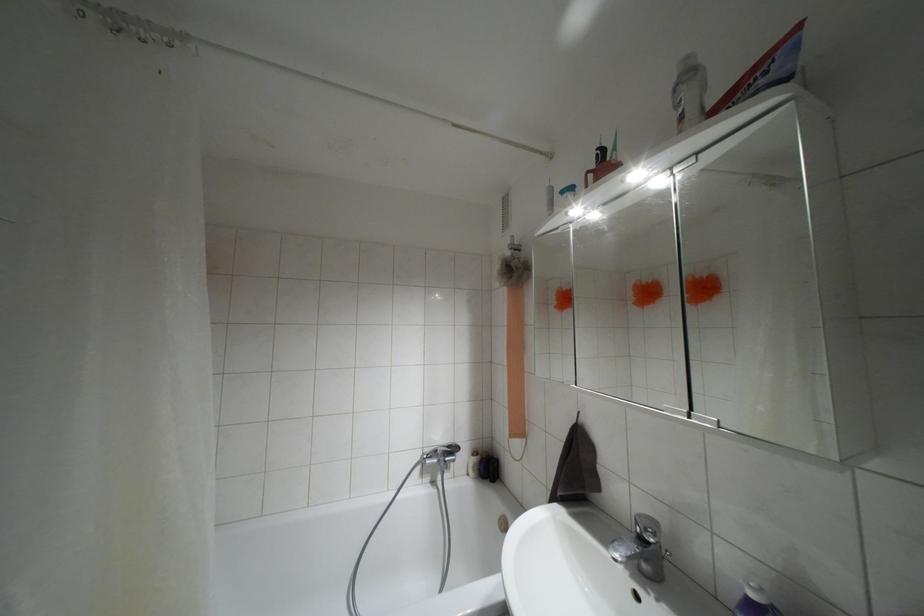
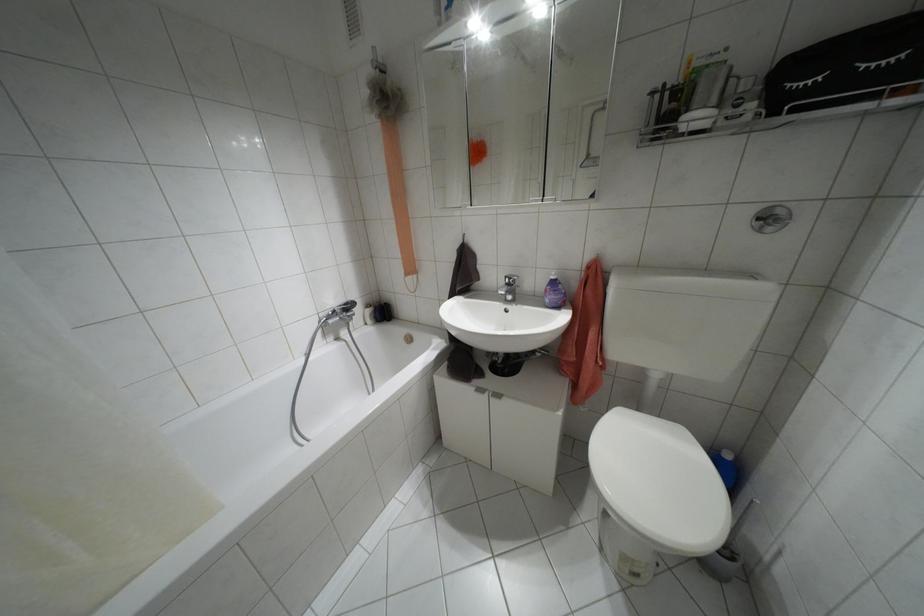
In the second image, find the point that corresponds to (x=641, y=538) in the first image.

(507, 284)